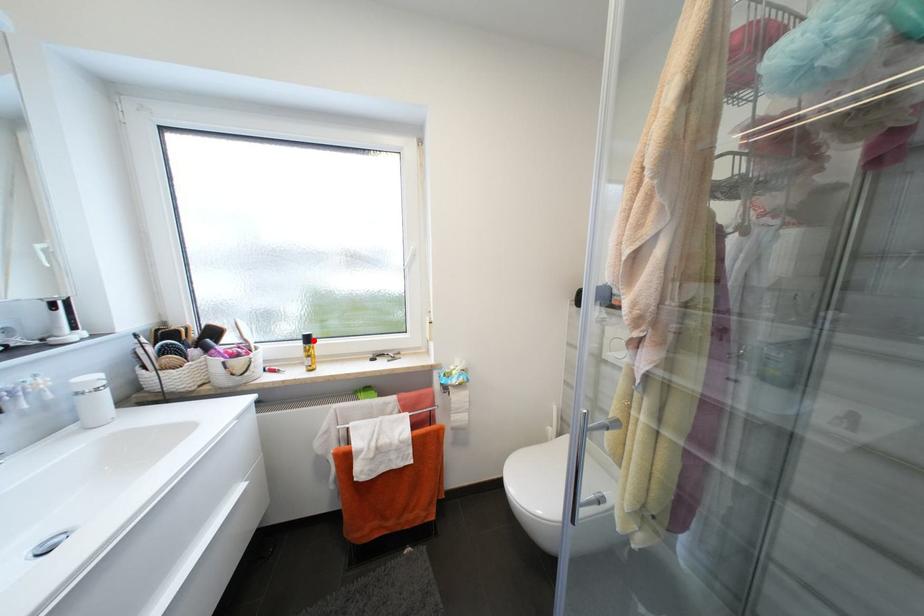
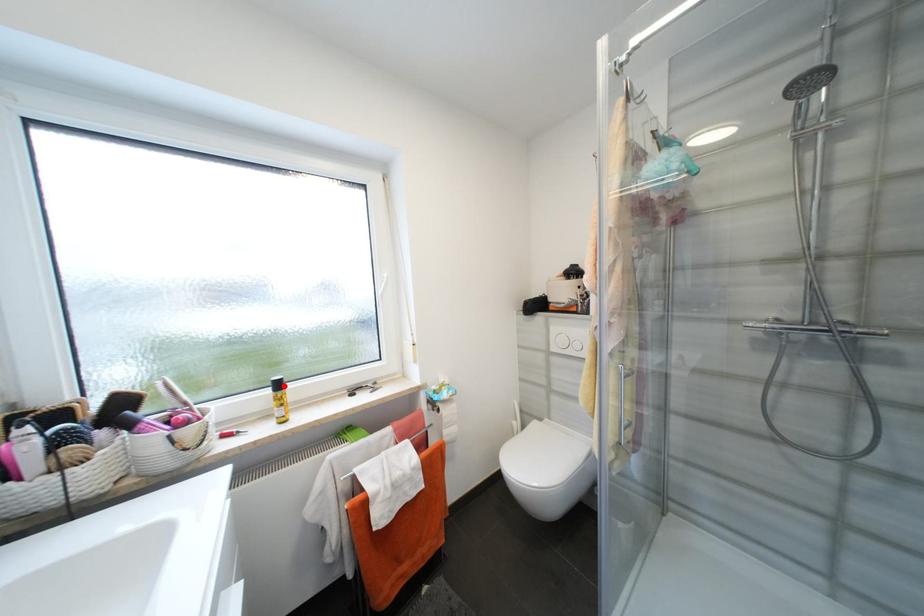
I am providing you with two images of the same scene from different viewpoints. A red point is marked on the first image and another point is marked on the second image. Do the highlighted points in image1 and image2 indicate the same real-world spot?

Yes